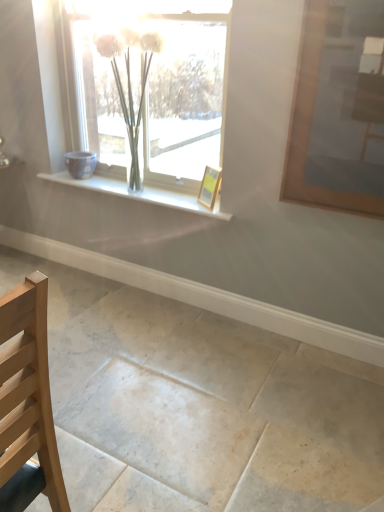
This screenshot has height=512, width=384. Describe the element at coordinates (199, 406) in the screenshot. I see `smooth stone floor at center` at that location.

Where is `light wood chair at lower left`? This screenshot has width=384, height=512. light wood chair at lower left is located at coordinates (27, 402).

Describe the element at coordinates (338, 109) in the screenshot. This screenshot has height=512, width=384. I see `wooden picture frame at upper right, the second picture frame from the left` at that location.

What is the approximate height of wooden picture frame at center, the 1th picture frame positioned from the back?

The height of wooden picture frame at center, the 1th picture frame positioned from the back, is 10.23 inches.

What are the coordinates of `smooth stone floor at center` in the screenshot? It's located at (199, 406).

Considering the positions of objects smooth stone floor at center and clear glass vase at upper center in the image provided, who is in front, smooth stone floor at center or clear glass vase at upper center?

Positioned in front is smooth stone floor at center.

The image size is (384, 512). I want to click on window above the smooth stone floor at center (from a real-world perspective), so click(x=158, y=93).

Is clear glass vase at upper center completely or partially inside smooth stone floor at center?

That's incorrect, clear glass vase at upper center is not inside smooth stone floor at center.

In terms of width, does smooth stone floor at center look wider or thinner when compared to clear glass vase at upper center?

In the image, smooth stone floor at center appears to be wider than clear glass vase at upper center.

Are wooden picture frame at center, which ranks as the first picture frame in left-to-right order, and white glossy window sill at center far apart?

No.

Based on their positions, is wooden picture frame at center, the 1th picture frame positioned from the back, located to the left or right of white glossy window sill at center?

wooden picture frame at center, the 1th picture frame positioned from the back, is positioned on white glossy window sill at center's right side.

Is wooden picture frame at center, the second picture frame positioned from the front, positioned with its back to white glossy window sill at center?

wooden picture frame at center, the second picture frame positioned from the front, is not turned away from white glossy window sill at center.

Which of these two, light wood chair at lower left or smooth stone floor at center, is smaller?

light wood chair at lower left is smaller.

How different are the orientations of light wood chair at lower left and smooth stone floor at center in degrees?

91 degrees.

Can you confirm if light wood chair at lower left is shorter than smooth stone floor at center?

In fact, light wood chair at lower left may be taller than smooth stone floor at center.

From a real-world perspective, between light wood chair at lower left and smooth stone floor at center, who is vertically lower?

smooth stone floor at center is physically lower.

From a real-world perspective, is white glossy window sill at center physically below smooth stone floor at center?

No.

Considering the sizes of objects white glossy window sill at center and smooth stone floor at center in the image provided, who is bigger, white glossy window sill at center or smooth stone floor at center?

Bigger between the two is smooth stone floor at center.

Which object is further away from the camera taking this photo, white glossy window sill at center or smooth stone floor at center?

white glossy window sill at center is more distant.

From the image's perspective, which one is positioned lower, white glossy window sill at center or smooth stone floor at center?

smooth stone floor at center appears lower in the image.

Which is more to the right, clear glass vase at upper center or smooth stone floor at center?

clear glass vase at upper center.

Do you think clear glass vase at upper center is within smooth stone floor at center, or outside of it?

clear glass vase at upper center lies outside smooth stone floor at center.

Is clear glass vase at upper center touching smooth stone floor at center?

No, clear glass vase at upper center is not touching smooth stone floor at center.

Identify the location of concrete located underneath the clear glass vase at upper center (from a real-world perspective). tap(199, 406).

From the image's perspective, which one is positioned higher, wooden picture frame at upper right, marked as the 1th picture frame in a right-to-left arrangement, or clear glass vase at upper center?

clear glass vase at upper center is shown above in the image.

Relative to clear glass vase at upper center, is wooden picture frame at upper right, the second picture frame from the left, in front or behind?

wooden picture frame at upper right, the second picture frame from the left, is positioned closer to the viewer than clear glass vase at upper center.

Can you confirm if wooden picture frame at upper right, the second picture frame from the left, is positioned to the right of clear glass vase at upper center?

Indeed, wooden picture frame at upper right, the second picture frame from the left, is positioned on the right side of clear glass vase at upper center.

In the scene shown: Would you consider smooth stone floor at center to be distant from white glossy window sill at center?

No, smooth stone floor at center is not far from white glossy window sill at center.

The image size is (384, 512). Identify the location of concrete below the white glossy window sill at center (from the image's perspective). (199, 406).

From a real-world perspective, is smooth stone floor at center located higher than white glossy window sill at center?

No.

Considering the relative sizes of smooth stone floor at center and white glossy window sill at center in the image provided, is smooth stone floor at center bigger than white glossy window sill at center?

Yes, smooth stone floor at center is bigger than white glossy window sill at center.

The width and height of the screenshot is (384, 512). Find the location of `concrete lying in front of the clear glass vase at upper center`. concrete lying in front of the clear glass vase at upper center is located at coordinates (199, 406).

The width and height of the screenshot is (384, 512). In order to click on the 1st picture frame to the right of the white glossy window sill at center, starting your count from the anchor in this screenshot , I will do `click(209, 187)`.

From the image, which object appears to be farther from clear glass vase at upper center, wooden picture frame at upper right, which ranks as the 2th picture frame in back-to-front order, or smooth stone floor at center?

smooth stone floor at center is further to clear glass vase at upper center.

Looking at the image, which one is located closer to wooden picture frame at upper right, marked as the 1th picture frame in a right-to-left arrangement, white glossy window sill at center or light wood chair at lower left?

white glossy window sill at center is closer to wooden picture frame at upper right, marked as the 1th picture frame in a right-to-left arrangement.

Based on their spatial positions, is light wood chair at lower left or white glossy window sill at center further from clear glass vase at upper center?

Among the two, light wood chair at lower left is located further to clear glass vase at upper center.

Looking at the image, which one is located closer to clear glass vase at upper center, wooden picture frame at center, the 1th picture frame positioned from the back, or wooden picture frame at upper right, the first picture frame viewed from the front?

Among the two, wooden picture frame at center, the 1th picture frame positioned from the back, is located nearer to clear glass vase at upper center.

Looking at the image, which one is located further to clear glass vase at upper center, white glossy window sill at center or wooden picture frame at upper right, which ranks as the 2th picture frame in back-to-front order?

The object further to clear glass vase at upper center is wooden picture frame at upper right, which ranks as the 2th picture frame in back-to-front order.

Looking at the image, which one is located closer to white glossy window sill at center, light wood chair at lower left or wooden picture frame at center, the second picture frame positioned from the front?

wooden picture frame at center, the second picture frame positioned from the front.

Looking at the image, which one is located further to smooth stone floor at center, white glossy window sill at center or light wood chair at lower left?

light wood chair at lower left is further to smooth stone floor at center.

Looking at the image, which one is located closer to clear glass vase at upper center, light wood chair at lower left or wooden picture frame at center, which ranks as the second picture frame in right-to-left order?

Among the two, wooden picture frame at center, which ranks as the second picture frame in right-to-left order, is located nearer to clear glass vase at upper center.

Identify the location of picture frame between white glossy window sill at center and wooden picture frame at upper right, the second picture frame from the left. Image resolution: width=384 pixels, height=512 pixels. (209, 187).

At what (x,y) coordinates should I click in order to perform the action: click on picture frame situated between clear glass vase at upper center and wooden picture frame at upper right, which ranks as the 2th picture frame in back-to-front order, from left to right. Please return your answer as a coordinate pair (x, y). Image resolution: width=384 pixels, height=512 pixels. Looking at the image, I should click on (209, 187).

Locate an element on the screen. chair between clear glass vase at upper center and smooth stone floor at center in the up-down direction is located at coordinates [x=27, y=402].

Where is `picture frame positioned between light wood chair at lower left and wooden picture frame at center, the second picture frame positioned from the front, from near to far`? The height and width of the screenshot is (512, 384). picture frame positioned between light wood chair at lower left and wooden picture frame at center, the second picture frame positioned from the front, from near to far is located at coordinates (338, 109).